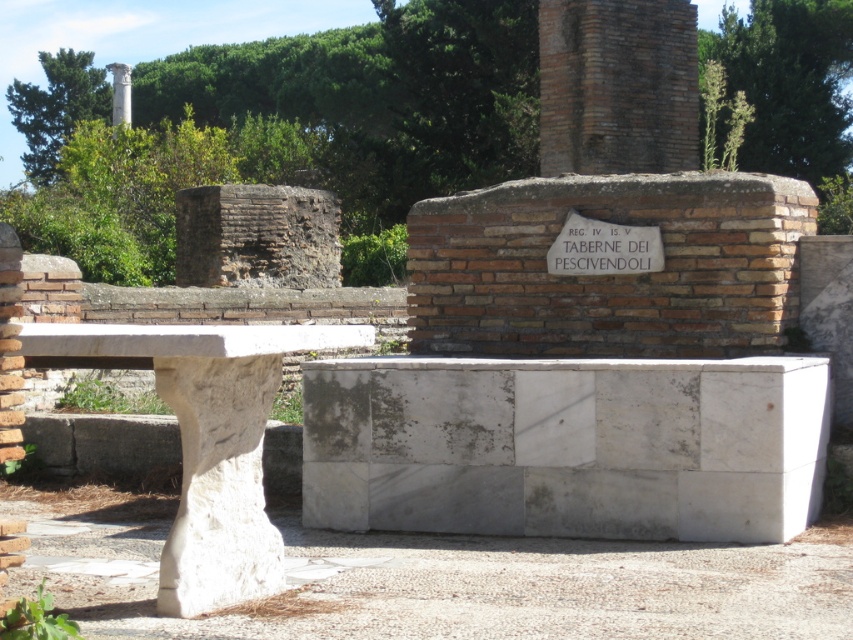
Question: Observing the image, what is the correct spatial positioning of white marble bench at lower left in reference to white stone column at upper left?

Choices:
 (A) right
 (B) left

Answer: (A)

Question: Which point is farther to the camera?

Choices:
 (A) white stone column at upper left
 (B) brown brick wall at upper left
 (C) white marble plaque at center
 (D) white marble bench at lower left

Answer: (A)

Question: Is white marble plaque at center in front of white stone column at upper left?

Choices:
 (A) no
 (B) yes

Answer: (B)

Question: Which point is closer to the camera taking this photo?

Choices:
 (A) (556, 170)
 (B) (651, 227)
 (C) (173, 561)
 (D) (119, 124)

Answer: (C)

Question: Is brown brick wall at upper left positioned in front of white stone column at upper left?

Choices:
 (A) yes
 (B) no

Answer: (A)

Question: Among these points, which one is farthest from the camera?

Choices:
 (A) (668, 3)
 (B) (195, 221)

Answer: (A)